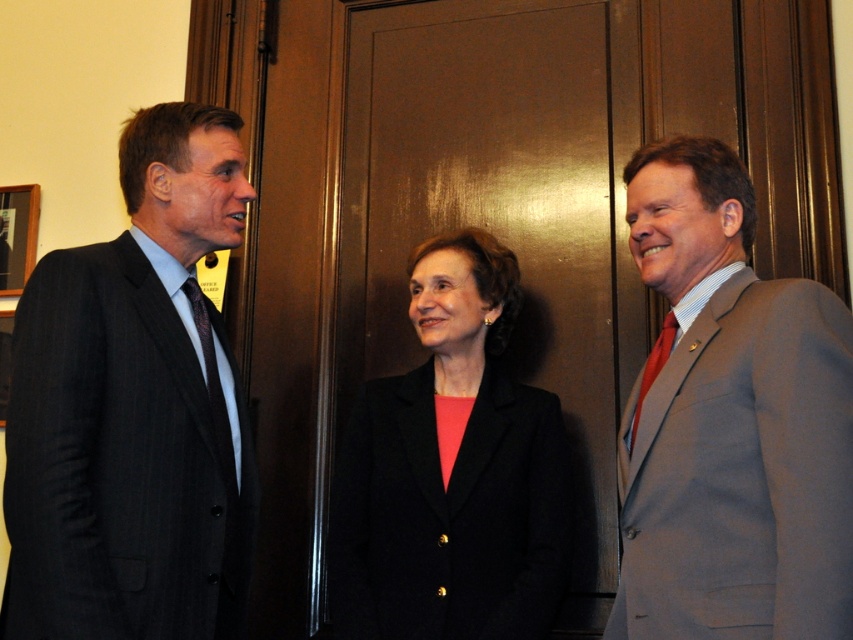
Can you confirm if dark gray suit at left is smaller than gray wool suit at right?

Yes, dark gray suit at left is smaller than gray wool suit at right.

Who is positioned more to the right, dark gray suit at left or gray wool suit at right?

Positioned to the right is gray wool suit at right.

This screenshot has width=853, height=640. Identify the location of dark gray suit at left. (134, 408).

Who is shorter, gray wool suit at right or red silk tie at right?

red silk tie at right

Can you confirm if gray wool suit at right is positioned below red silk tie at right?

Incorrect, gray wool suit at right is not positioned below red silk tie at right.

Where is `gray wool suit at right`? gray wool suit at right is located at coordinates (730, 422).

Find the location of `gray wool suit at right`. gray wool suit at right is located at coordinates (730, 422).

Consider the image. Is dark gray suit at left above dark blue textured tie at left?

Yes.

Can you confirm if dark gray suit at left is wider than dark blue textured tie at left?

Correct, the width of dark gray suit at left exceeds that of dark blue textured tie at left.

Describe the element at coordinates (134, 408) in the screenshot. I see `dark gray suit at left` at that location.

Locate an element on the screen. The width and height of the screenshot is (853, 640). dark gray suit at left is located at coordinates (134, 408).